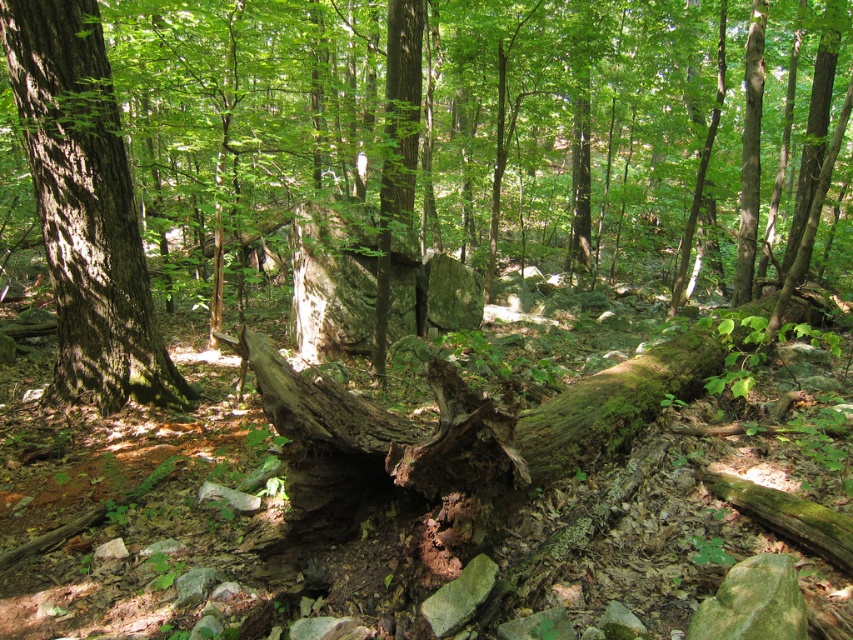
Question: Which of the following is the closest to the observer?

Choices:
 (A) (183, 93)
 (B) (142, 260)

Answer: (B)

Question: Can you confirm if smooth bark tree at center is positioned above smooth brown tree trunk at left?

Choices:
 (A) no
 (B) yes

Answer: (B)

Question: From the image, what is the correct spatial relationship of smooth bark tree at center in relation to smooth brown tree trunk at left?

Choices:
 (A) left
 (B) right

Answer: (B)

Question: Can you confirm if smooth bark tree at center is wider than smooth brown tree trunk at left?

Choices:
 (A) yes
 (B) no

Answer: (A)

Question: Among these points, which one is farthest from the camera?

Choices:
 (A) (428, 97)
 (B) (10, 81)

Answer: (A)